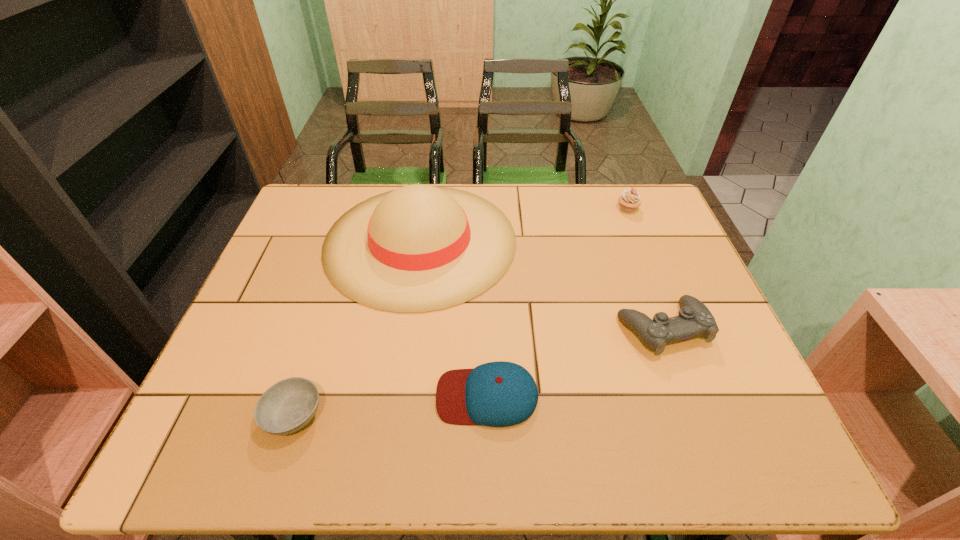
The height and width of the screenshot is (540, 960). In order to click on vacant area that satisfies the following two spatial constraints: 1. on the back side of the cupcake; 2. on the right side of the control in this screenshot , I will do `click(618, 208)`.

You are a GUI agent. You are given a task and a screenshot of the screen. Output one action in this format:
    pyautogui.click(x=<x>, y=<y>)
    Task: Click on the free spot that satisfies the following two spatial constraints: 1. on the back side of the bowl; 2. on the right side of the cupcake
    This screenshot has height=540, width=960.
    Given the screenshot: What is the action you would take?
    pyautogui.click(x=360, y=208)